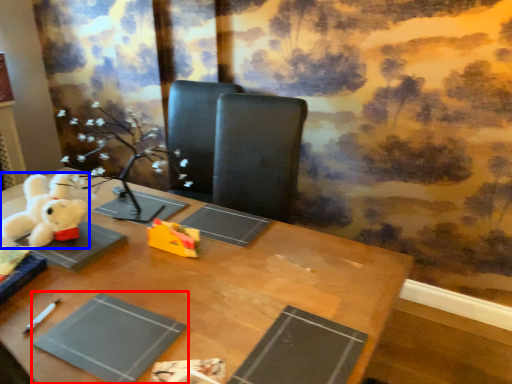
Question: Which object appears closest to the camera in this image, paperback book (highlighted by a red box) or toy (highlighted by a blue box)?

Choices:
 (A) paperback book
 (B) toy

Answer: (A)